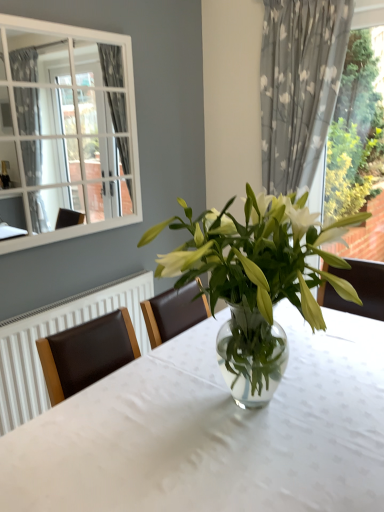
Image resolution: width=384 pixels, height=512 pixels. Find the location of `empty space that is ontop of transparent glass vase at center (from a real-world perspective)`. empty space that is ontop of transparent glass vase at center (from a real-world perspective) is located at coordinates (243, 411).